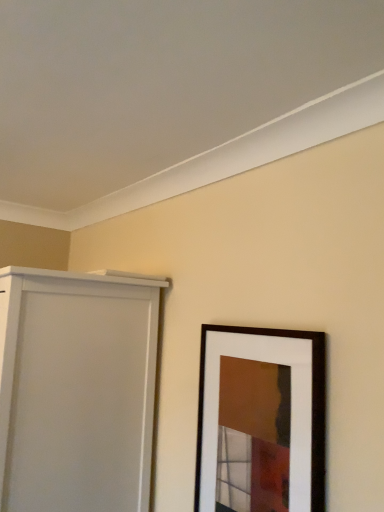
Question: Does white matte door at left appear on the left side of wooden picture frame at lower right?

Choices:
 (A) no
 (B) yes

Answer: (B)

Question: Considering the relative sizes of white matte door at left and wooden picture frame at lower right in the image provided, is white matte door at left taller than wooden picture frame at lower right?

Choices:
 (A) no
 (B) yes

Answer: (B)

Question: Is there a large distance between white matte door at left and wooden picture frame at lower right?

Choices:
 (A) no
 (B) yes

Answer: (A)

Question: Is white matte door at left turned away from wooden picture frame at lower right?

Choices:
 (A) no
 (B) yes

Answer: (A)

Question: Considering the relative sizes of white matte door at left and wooden picture frame at lower right in the image provided, is white matte door at left bigger than wooden picture frame at lower right?

Choices:
 (A) no
 (B) yes

Answer: (B)

Question: Is white matte door at left smaller than wooden picture frame at lower right?

Choices:
 (A) no
 (B) yes

Answer: (A)

Question: Does wooden picture frame at lower right come in front of white matte door at left?

Choices:
 (A) yes
 (B) no

Answer: (A)

Question: Can you confirm if wooden picture frame at lower right is smaller than white matte door at left?

Choices:
 (A) no
 (B) yes

Answer: (B)

Question: Is wooden picture frame at lower right positioned with its back to white matte door at left?

Choices:
 (A) no
 (B) yes

Answer: (A)

Question: Can you confirm if wooden picture frame at lower right is shorter than white matte door at left?

Choices:
 (A) no
 (B) yes

Answer: (B)

Question: Does wooden picture frame at lower right lie behind white matte door at left?

Choices:
 (A) no
 (B) yes

Answer: (A)

Question: From a real-world perspective, is wooden picture frame at lower right located higher than white matte door at left?

Choices:
 (A) no
 (B) yes

Answer: (B)

Question: Based on their sizes in the image, would you say white matte door at left is bigger or smaller than wooden picture frame at lower right?

Choices:
 (A) small
 (B) big

Answer: (B)